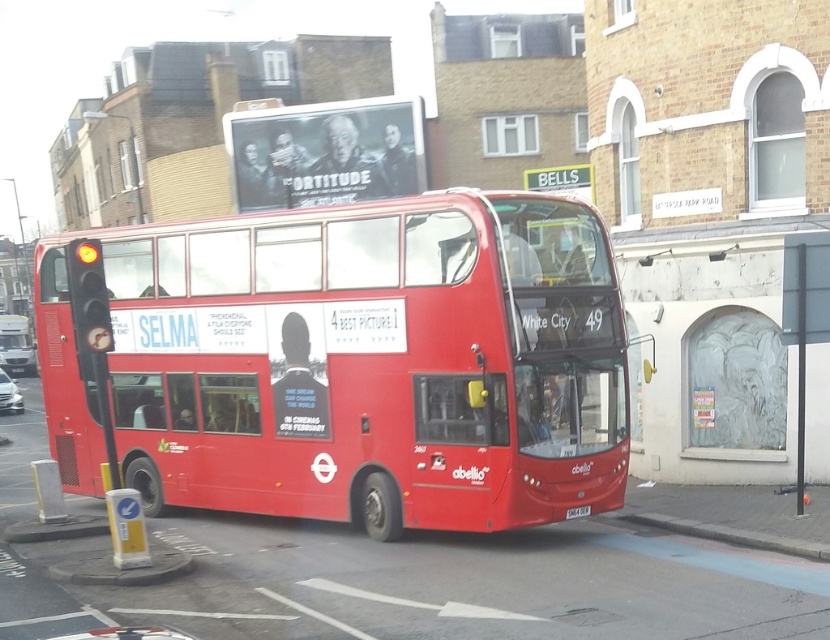
Question: Estimate the real-world distances between objects in this image. Which object is farther from the yellow glass traffic light at left?

Choices:
 (A) metallic pole at center
 (B) matte red bus at center
 (C) shiny red bus at center
 (D) white plastic license plate at center

Answer: (B)

Question: Among these points, which one is farthest from the camera?

Choices:
 (A) (12, 346)
 (B) (828, 282)
 (C) (565, 512)
 (D) (499, 497)

Answer: (A)

Question: Can you confirm if shiny red bus at center is positioned below metallic pole at center?

Choices:
 (A) yes
 (B) no

Answer: (A)

Question: Does yellow glass traffic light at left appear on the left side of matte red bus at center?

Choices:
 (A) yes
 (B) no

Answer: (B)

Question: Which point is closer to the camera?

Choices:
 (A) yellow glass traffic light at left
 (B) white plastic license plate at center
 (C) metallic pole at center
 (D) matte red bus at center

Answer: (A)

Question: From the image, what is the correct spatial relationship of shiny red bus at center in relation to metallic pole at center?

Choices:
 (A) left
 (B) right

Answer: (A)